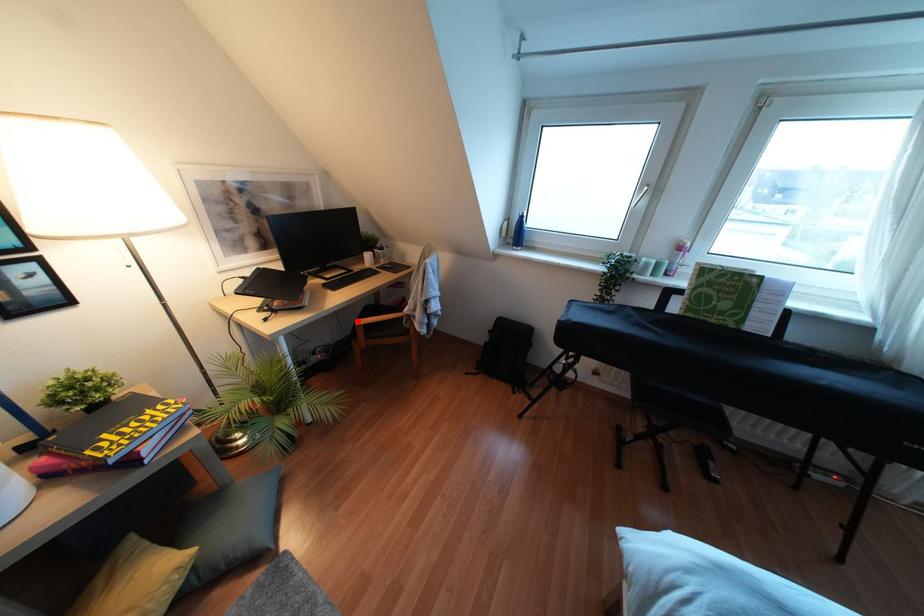
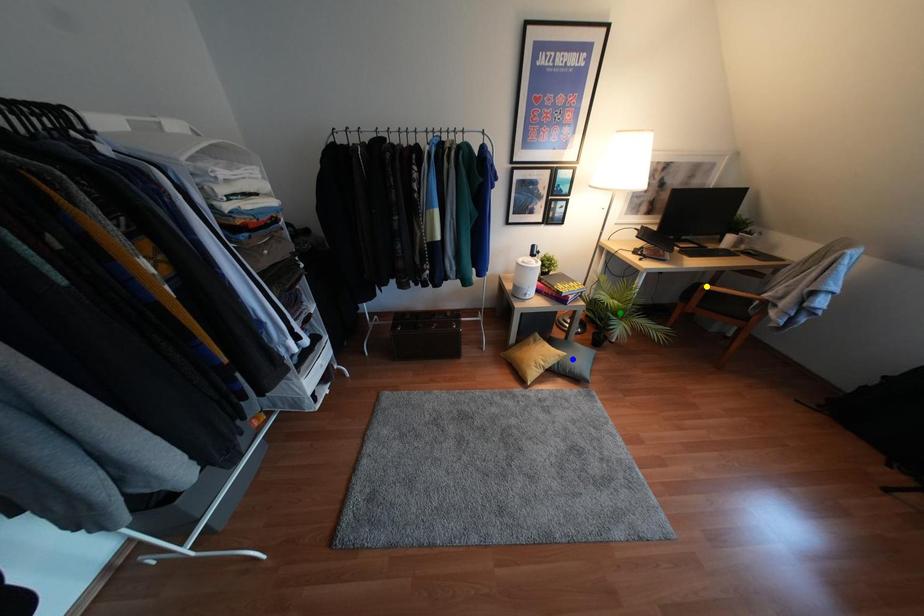
Question: I am providing you with two images of the same scene from different viewpoints. A red point is marked on the first image. You are given multiple points on the second image. Which mark in image 2 goes with the point in image 1?

Choices:
 (A) green point
 (B) blue point
 (C) yellow point

Answer: (C)